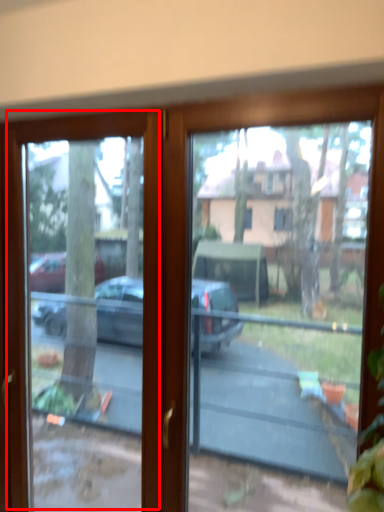
Question: In this image, where is screen door (annotated by the red box) located relative to bay window?

Choices:
 (A) right
 (B) left

Answer: (B)